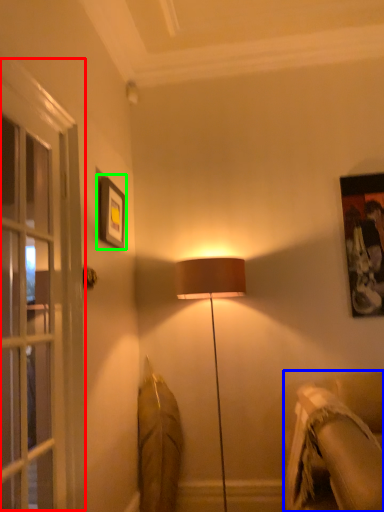
Question: Based on their relative distances, which object is farther from screen door (highlighted by a red box)? Choose from studio couch (highlighted by a blue box) and picture frame (highlighted by a green box).

Choices:
 (A) studio couch
 (B) picture frame

Answer: (A)